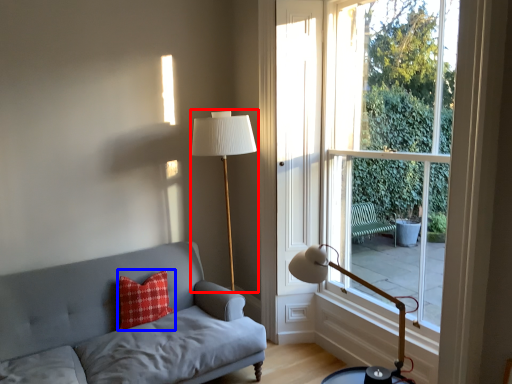
Question: Which object is closer to the camera taking this photo, table lamp (highlighted by a red box) or pillow (highlighted by a blue box)?

Choices:
 (A) table lamp
 (B) pillow

Answer: (A)